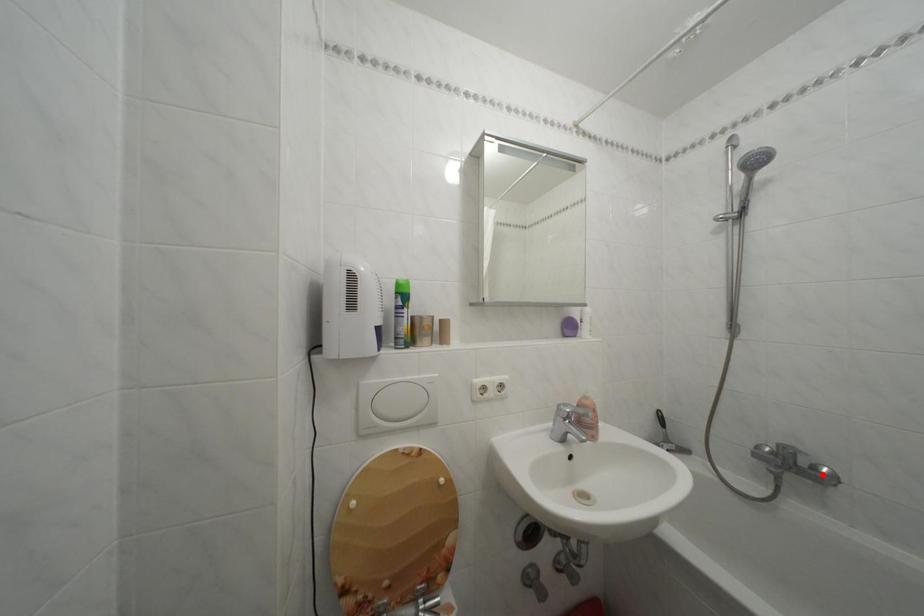
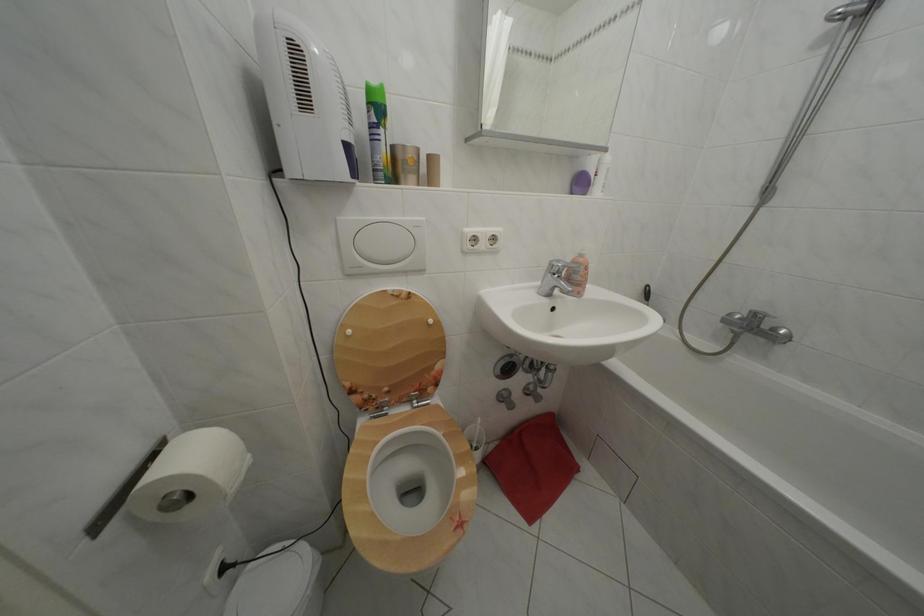
In the second image, find the point that corresponds to the highlighted location in the first image.

(783, 336)